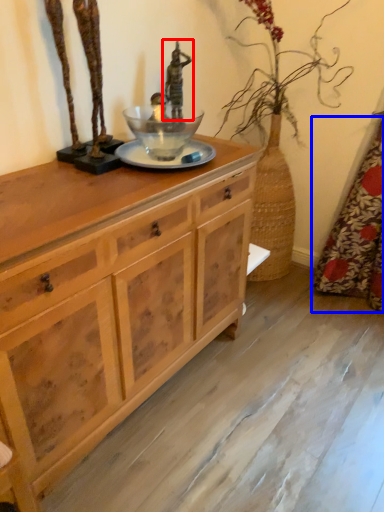
Question: Among these objects, which one is nearest to the camera, sculpture (highlighted by a red box) or curtain (highlighted by a blue box)?

Choices:
 (A) sculpture
 (B) curtain

Answer: (B)